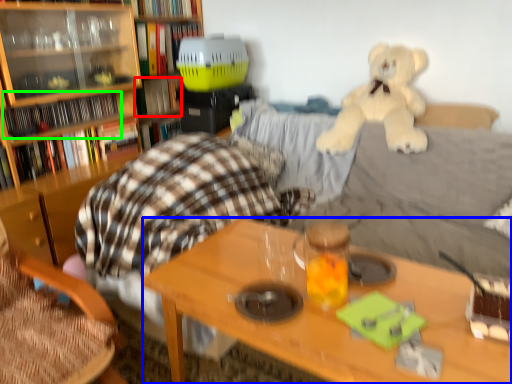
Question: Based on their relative distances, which object is nearer to book (highlighted by a red box)? Choose from desk (highlighted by a blue box) and book (highlighted by a green box).

Choices:
 (A) desk
 (B) book

Answer: (B)